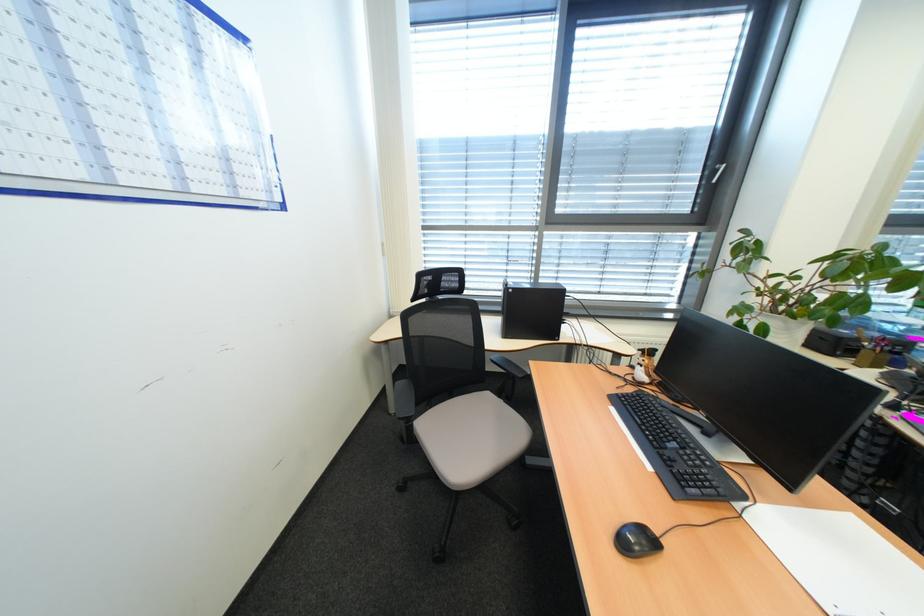
The width and height of the screenshot is (924, 616). In order to click on chair sitting surface in this screenshot , I will do `click(470, 438)`.